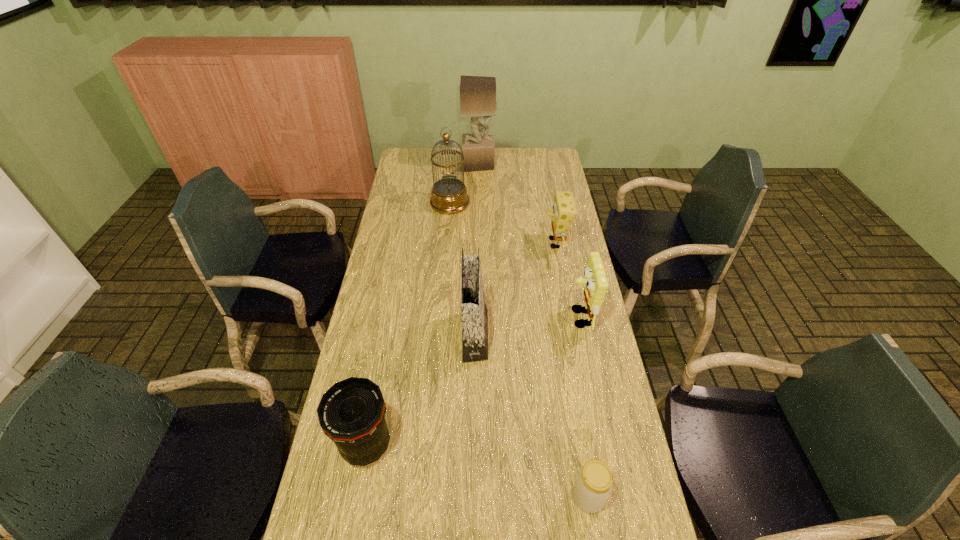
Where is `free space between the shopping bag and the second nearest object`? This screenshot has height=540, width=960. free space between the shopping bag and the second nearest object is located at coordinates pyautogui.click(x=420, y=390).

You are a GUI agent. You are given a task and a screenshot of the screen. Output one action in this format:
    pyautogui.click(x=<x>, y=<y>)
    Task: Click on the blank region between the third farthest object and the leftmost object
    
    Given the screenshot: What is the action you would take?
    pyautogui.click(x=461, y=345)

Locate an element on the screen. This screenshot has height=540, width=960. free space between the shopping bag and the farthest object is located at coordinates (477, 249).

Where is `object that ranks as the third closest to the shopping bag`? This screenshot has width=960, height=540. object that ranks as the third closest to the shopping bag is located at coordinates (564, 208).

At what (x,y) coordinates should I click in order to perform the action: click on the sixth closest object relative to the nearer sponge. Please return your answer as a coordinate pair (x, y). Looking at the image, I should click on (477, 93).